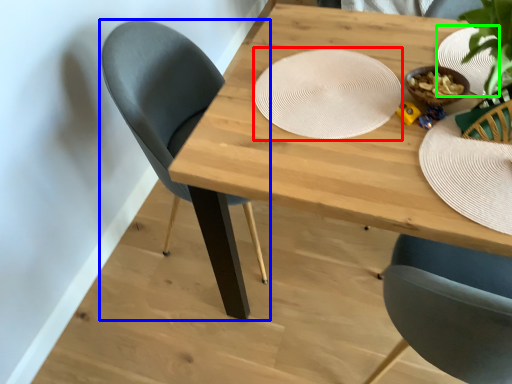
Question: Based on their relative distances, which object is nearer to platter (highlighted by a red box)? Choose from chair (highlighted by a blue box) and paper plate (highlighted by a green box).

Choices:
 (A) chair
 (B) paper plate

Answer: (B)